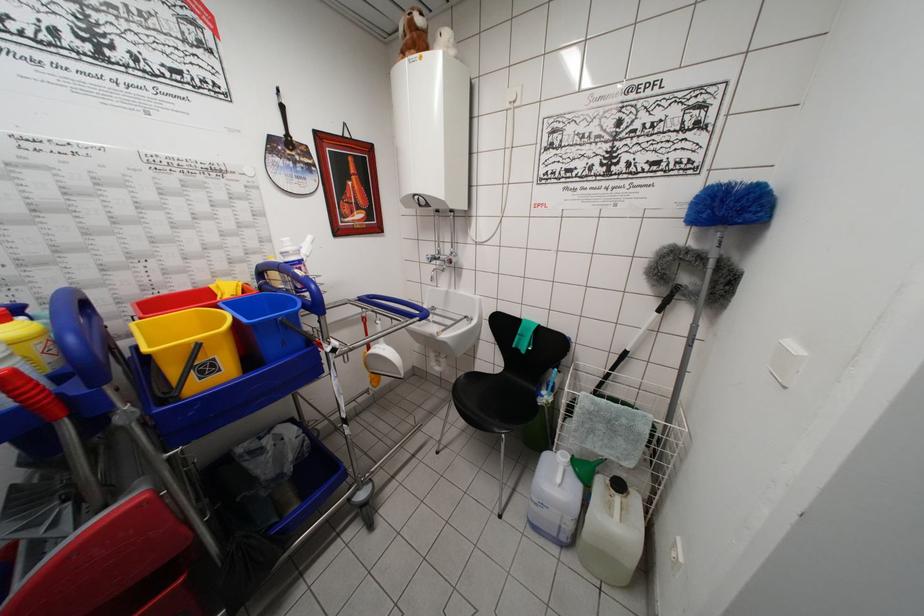
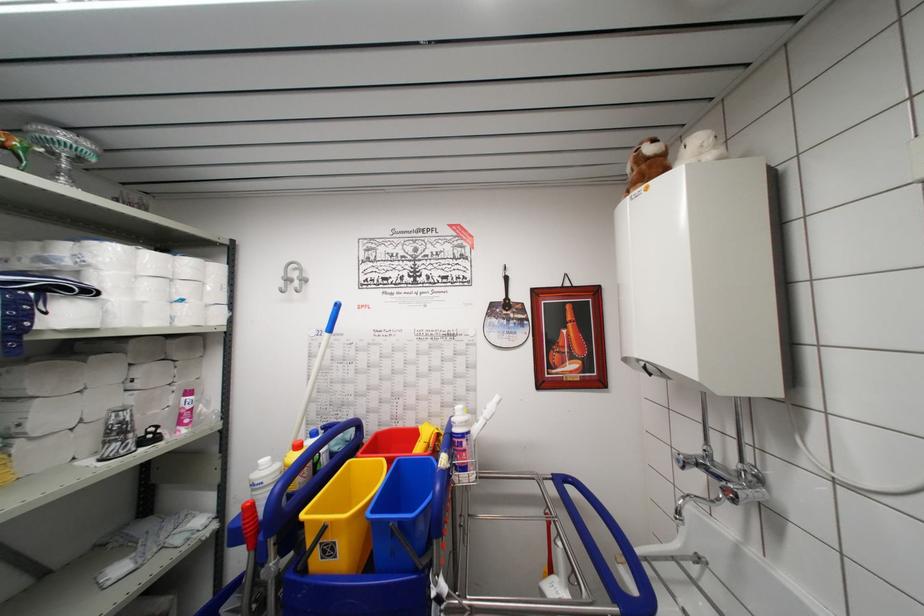
Question: The camera is either moving clockwise (left) or counter-clockwise (right) around the object. The first image is from the beginning of the video and the second image is from the end. Is the camera moving left or right when shooting the video?

Choices:
 (A) Left
 (B) Right

Answer: (B)